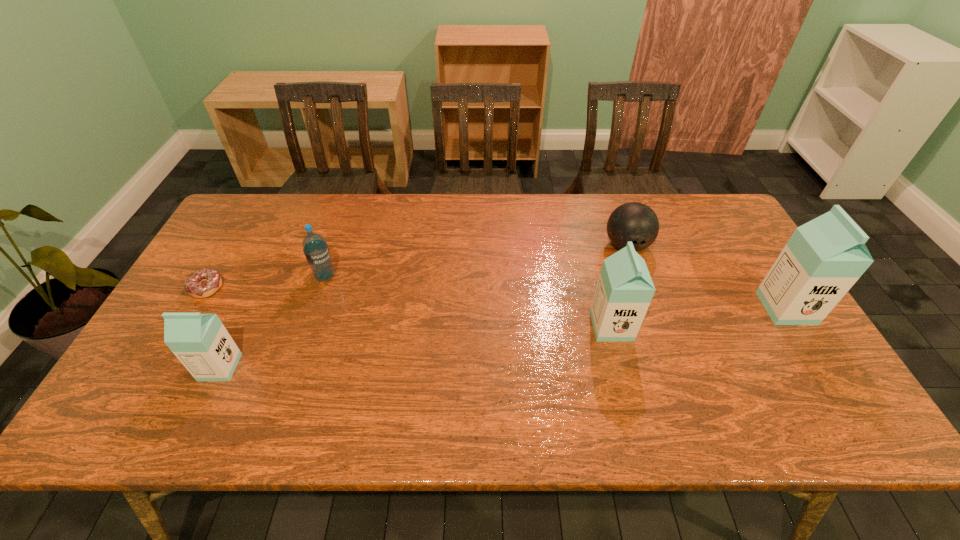
Where is `the shortest object`? Image resolution: width=960 pixels, height=540 pixels. the shortest object is located at coordinates (203, 283).

The width and height of the screenshot is (960, 540). I want to click on vacant area situated on the right of the nearest object, so click(265, 367).

In order to click on free location located 0.140m on the right of the second shortest milk carton in this screenshot , I will do `click(684, 326)`.

Where is `vacant space situated on the back of the rightmost milk carton`? The image size is (960, 540). vacant space situated on the back of the rightmost milk carton is located at coordinates (746, 244).

Find the location of `vacant region located on the grip area of the farthest object`. vacant region located on the grip area of the farthest object is located at coordinates (656, 330).

Identify the location of free space located 0.080m on the right of the fourth object from right to left. Image resolution: width=960 pixels, height=540 pixels. (364, 276).

Locate an element on the screen. This screenshot has height=540, width=960. free space located 0.140m on the front of the doughnut is located at coordinates (175, 343).

Locate an element on the screen. The height and width of the screenshot is (540, 960). object present at the far edge is located at coordinates (635, 222).

The image size is (960, 540). What are the coordinates of `object at the near edge` in the screenshot? It's located at (200, 341).

Where is `milk carton that is at the left edge`? This screenshot has width=960, height=540. milk carton that is at the left edge is located at coordinates (200, 341).